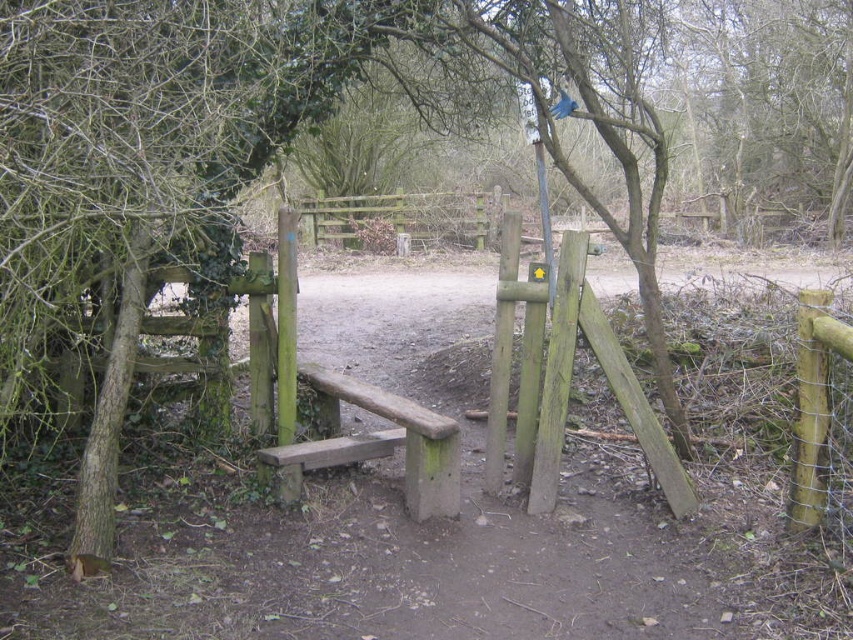
Question: Is green mossy wood bench at center to the left of green wooden post at right from the viewer's perspective?

Choices:
 (A) no
 (B) yes

Answer: (B)

Question: Which point is farther to the camera?

Choices:
 (A) (428, 464)
 (B) (387, 198)

Answer: (B)

Question: Observing the image, what is the correct spatial positioning of wooden gate at center in reference to green wooden post at right?

Choices:
 (A) right
 (B) left

Answer: (B)

Question: Estimate the real-world distances between objects in this image. Which object is closer to the wooden gate at center?

Choices:
 (A) green mossy wood bench at center
 (B) green wooden post at right

Answer: (A)

Question: Can you confirm if green mossy wood bench at center is positioned to the left of wooden gate at center?

Choices:
 (A) yes
 (B) no

Answer: (B)

Question: Which of the following is the closest to the observer?

Choices:
 (A) (804, 396)
 (B) (366, 225)
 (C) (401, 413)

Answer: (A)